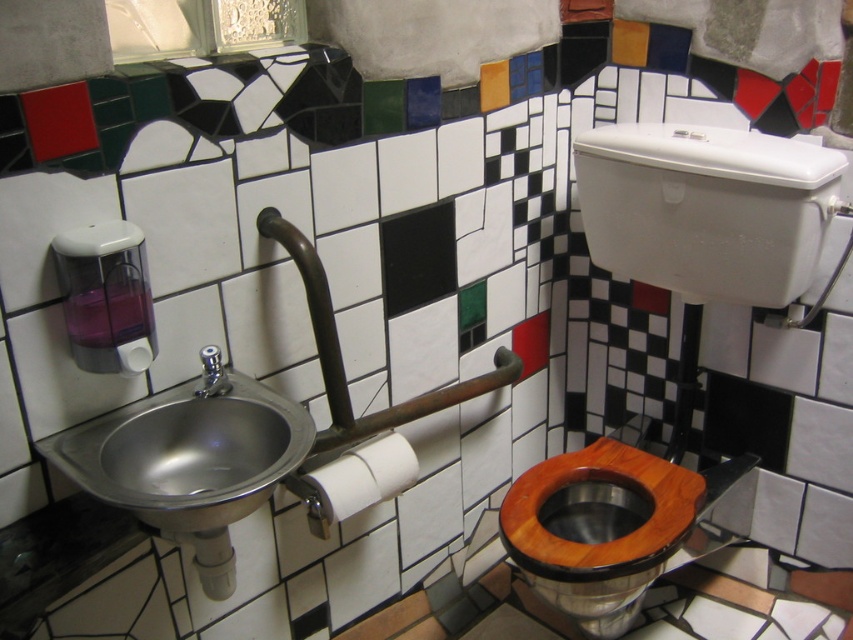
Is metallic sink at left wider than white paper at sink left?

Yes, metallic sink at left is wider than white paper at sink left.

Which is more to the right, metallic sink at left or white paper at sink left?

From the viewer's perspective, metallic sink at left appears more on the right side.

Who is more forward, (143, 486) or (125, 364)?

Point (125, 364) is more forward.

Locate an element on the screen. The image size is (853, 640). metallic sink at left is located at coordinates [x=187, y=452].

Does wooden at center have a larger size compared to white matte toilet paper at center?

Yes, wooden at center is bigger than white matte toilet paper at center.

Can you confirm if wooden at center is taller than white matte toilet paper at center?

Indeed, wooden at center has a greater height compared to white matte toilet paper at center.

Locate an element on the screen. wooden at center is located at coordinates (599, 529).

The width and height of the screenshot is (853, 640). I want to click on wooden at center, so click(x=599, y=529).

Who is more distant from viewer, (x=165, y=493) or (x=653, y=499)?

The point (x=653, y=499) is behind.

Is metallic sink at left bigger than wooden at center?

No.

The height and width of the screenshot is (640, 853). I want to click on metallic sink at left, so click(187, 452).